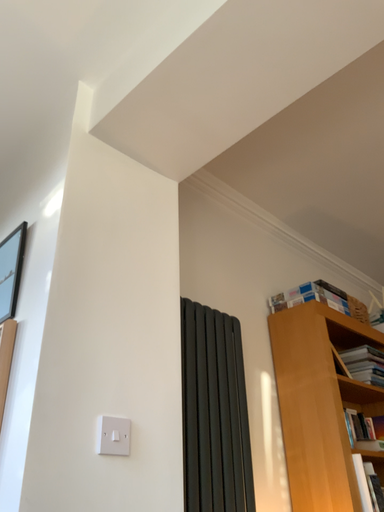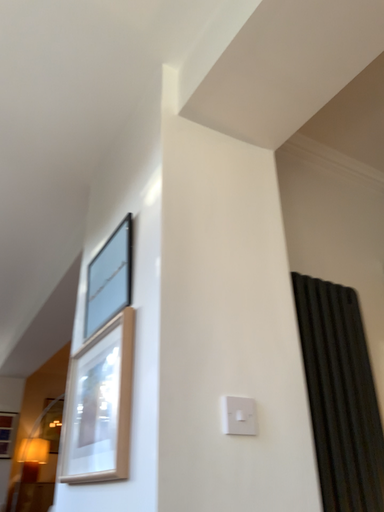
Question: Which way did the camera rotate in the video?

Choices:
 (A) rotated right
 (B) rotated left

Answer: (B)